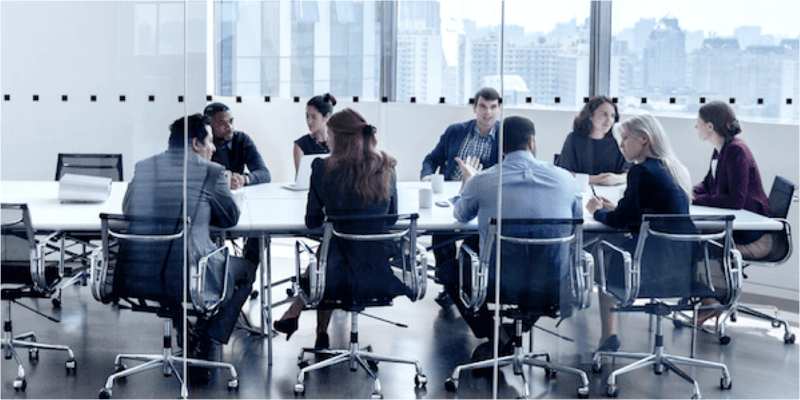
Find the location of a particular element. This screenshot has width=800, height=400. black office chair is located at coordinates (x=81, y=165), (x=14, y=243), (x=128, y=265), (x=336, y=256), (x=554, y=268), (x=661, y=259), (x=784, y=235), (x=554, y=157).